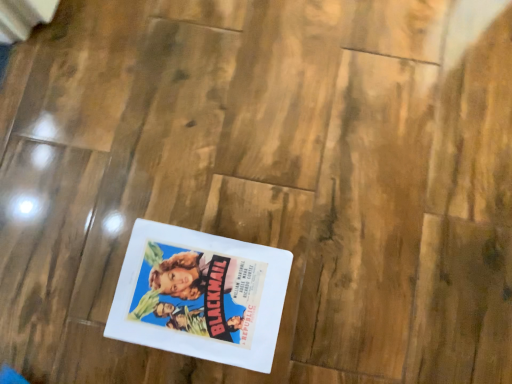
Identify the location of free point to the right of white paper at center. (333, 277).